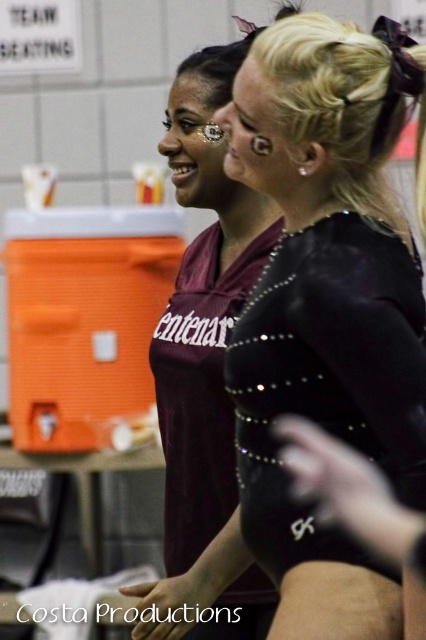
Identify the location of black shiny leotard at center. (328, 307).

Is point (284, 156) behind point (163, 589)?

No, (284, 156) is closer to viewer.

Who is more distant from viewer, (236, 140) or (207, 262)?

The point (207, 262) is more distant.

Locate an element on the screen. This screenshot has width=426, height=640. black shiny leotard at center is located at coordinates [x=328, y=307].